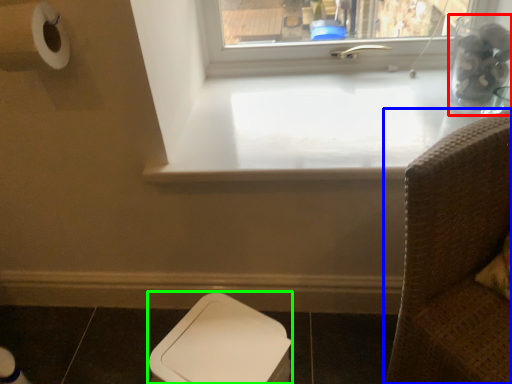
Question: Based on their relative distances, which object is farther from glass vase (highlighted by a red box)? Choose from furniture (highlighted by a blue box) and toilet bowl (highlighted by a green box).

Choices:
 (A) furniture
 (B) toilet bowl

Answer: (B)